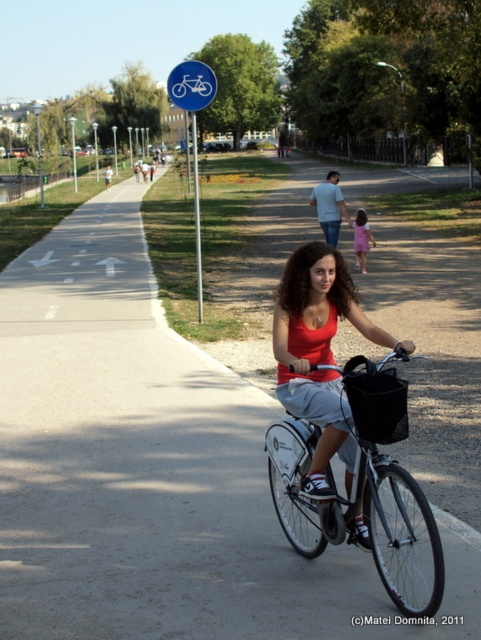
How much distance is there between matte red tank top at center and pink fabric dress at center?

The distance of matte red tank top at center from pink fabric dress at center is 11.67 meters.

In the scene shown: Can you confirm if matte red tank top at center is positioned above pink fabric dress at center?

No.

Between point (289, 310) and point (363, 248), which one is positioned behind?

The point (363, 248) is behind.

Where is `matte red tank top at center`? This screenshot has width=481, height=640. matte red tank top at center is located at coordinates (319, 355).

Who is higher up, white matte bicycle at center or matte red tank top at center?

matte red tank top at center is above.

From the picture: Is white matte bicycle at center to the left of matte red tank top at center from the viewer's perspective?

No, white matte bicycle at center is not to the left of matte red tank top at center.

Between point (312, 502) and point (316, 340), which one is positioned behind?

The point (312, 502) is more distant.

Identify the location of white matte bicycle at center. The height and width of the screenshot is (640, 481). (359, 483).

Who is more forward, (333, 209) or (361, 224)?

Point (361, 224) is in front.

Based on the photo, who is positioned more to the right, light blue jeans at center or pink fabric dress at center?

light blue jeans at center

Between point (350, 225) and point (364, 243), which one is positioned in front?

Point (364, 243) is more forward.

The image size is (481, 640). I want to click on light blue jeans at center, so click(329, 205).